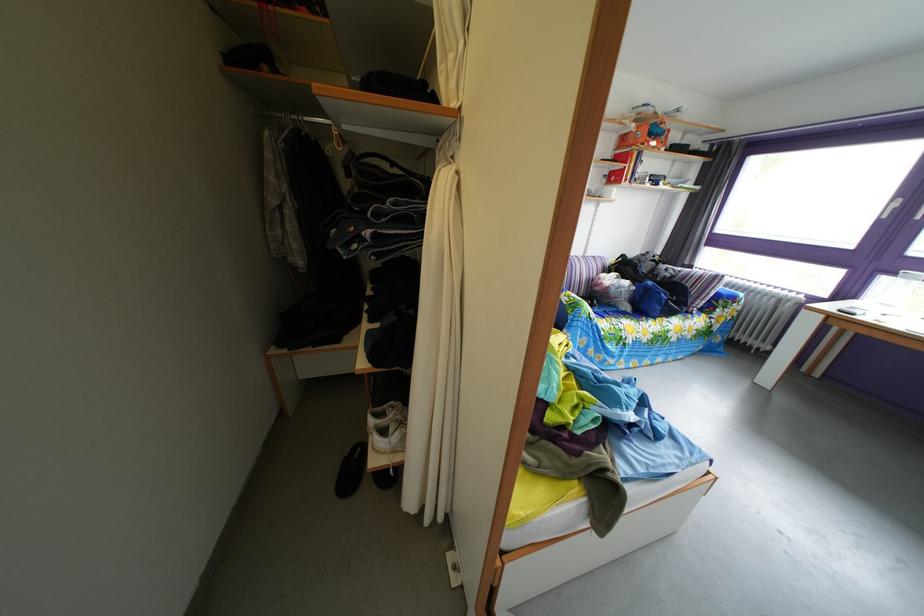
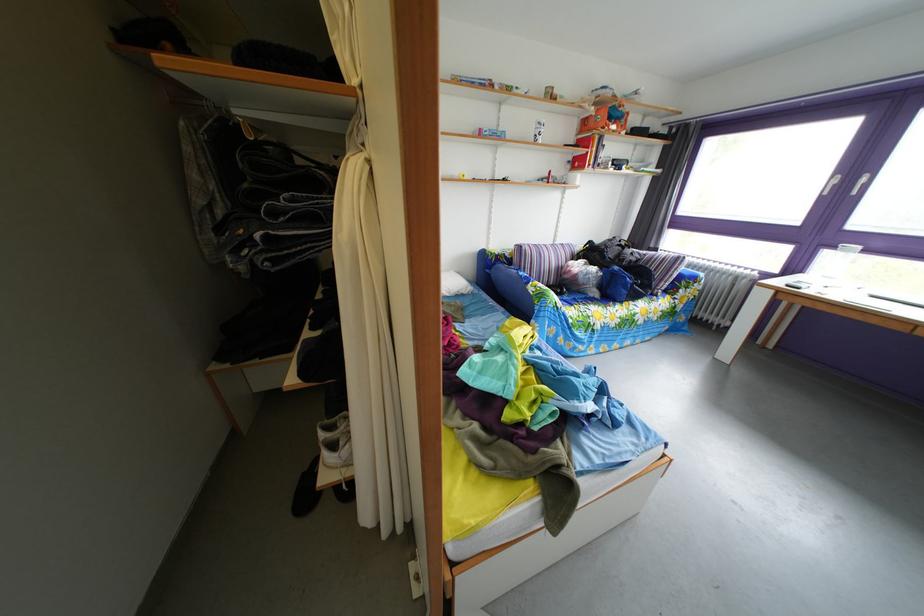
Question: The first image is from the beginning of the video and the second image is from the end. How did the camera likely rotate when shooting the video?

Choices:
 (A) Left
 (B) Right
 (C) Up
 (D) Down

Answer: (B)